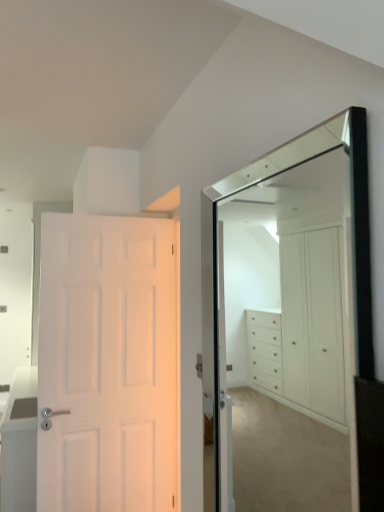
Question: Should I look upward or downward to see white matte door at left?

Choices:
 (A) up
 (B) down

Answer: (B)

Question: Is clear glass mirror at upper right thinner than white glossy cabinet at left?

Choices:
 (A) no
 (B) yes

Answer: (B)

Question: Is there a large distance between clear glass mirror at upper right and white glossy cabinet at left?

Choices:
 (A) yes
 (B) no

Answer: (A)

Question: Is clear glass mirror at upper right further to camera compared to white glossy cabinet at left?

Choices:
 (A) yes
 (B) no

Answer: (B)

Question: Does clear glass mirror at upper right have a lesser height compared to white glossy cabinet at left?

Choices:
 (A) no
 (B) yes

Answer: (A)

Question: Is white glossy cabinet at left a part of clear glass mirror at upper right?

Choices:
 (A) yes
 (B) no

Answer: (B)

Question: From a real-world perspective, does clear glass mirror at upper right sit lower than white glossy cabinet at left?

Choices:
 (A) no
 (B) yes

Answer: (A)

Question: Could you tell me if clear glass mirror at upper right is facing white matte door at left?

Choices:
 (A) no
 (B) yes

Answer: (A)

Question: Does clear glass mirror at upper right have a lesser width compared to white matte door at left?

Choices:
 (A) yes
 (B) no

Answer: (A)

Question: From a real-world perspective, is clear glass mirror at upper right physically above white matte door at left?

Choices:
 (A) yes
 (B) no

Answer: (A)

Question: Does clear glass mirror at upper right appear on the right side of white matte door at left?

Choices:
 (A) yes
 (B) no

Answer: (A)

Question: Is clear glass mirror at upper right to the left of white matte door at left from the viewer's perspective?

Choices:
 (A) no
 (B) yes

Answer: (A)

Question: Can you confirm if clear glass mirror at upper right is shorter than white matte door at left?

Choices:
 (A) no
 (B) yes

Answer: (B)

Question: From the image's perspective, would you say white glossy cabinet at left is shown under clear glass mirror at upper right?

Choices:
 (A) no
 (B) yes

Answer: (B)